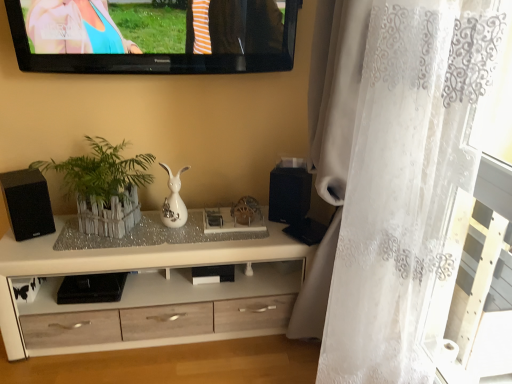
This screenshot has height=384, width=512. Find the location of `free spot above clear glass tray at center (from a real-world perspective)`. free spot above clear glass tray at center (from a real-world perspective) is located at coordinates (184, 225).